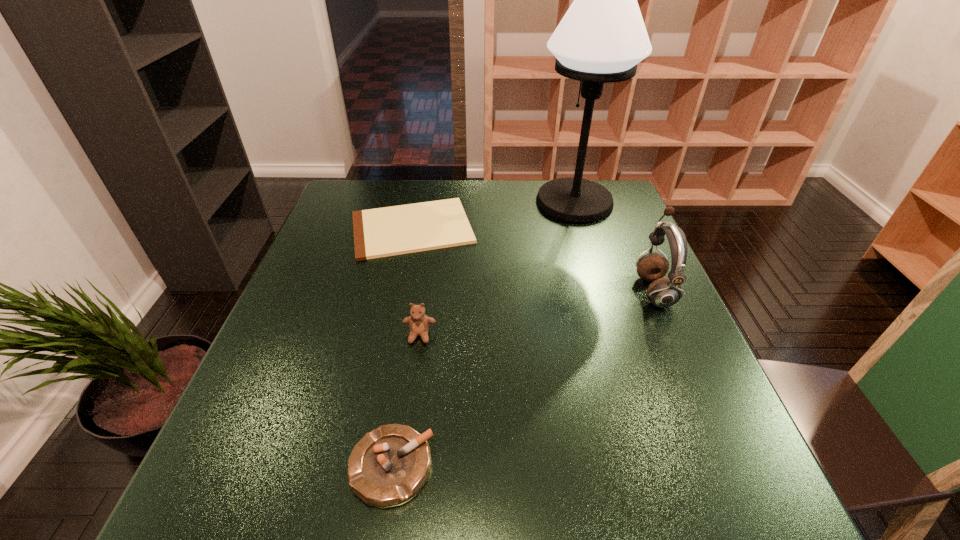
Locate an element on the screen. The height and width of the screenshot is (540, 960). earphone at the right edge is located at coordinates (664, 292).

I want to click on object at the far left corner, so click(389, 231).

The width and height of the screenshot is (960, 540). I want to click on object situated at the far right corner, so click(x=602, y=37).

Where is `vacant area at the far edge of the desktop`? vacant area at the far edge of the desktop is located at coordinates (514, 219).

Image resolution: width=960 pixels, height=540 pixels. What are the coordinates of `vacant area at the left edge` in the screenshot? It's located at (312, 335).

Locate an element on the screen. free space at the right edge of the desktop is located at coordinates (612, 266).

In the image, there is a desktop. At what (x,y) coordinates should I click in order to perform the action: click on vacant space at the far left corner. Please return your answer as a coordinate pair (x, y). This screenshot has width=960, height=540. Looking at the image, I should click on (357, 201).

Where is `free point between the table lamp and the shortest object`? The image size is (960, 540). free point between the table lamp and the shortest object is located at coordinates (493, 215).

Find the location of a particular element. vacant point located between the teddy bear and the earphone is located at coordinates (537, 313).

Locate an element on the screen. This screenshot has height=540, width=960. vacant space that's between the fourth farthest object and the shortest object is located at coordinates (416, 282).